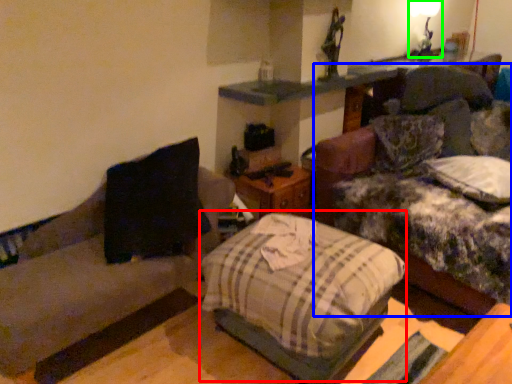
Question: Based on their relative distances, which object is nearer to bed (highlighted by a red box)? Choose from couch (highlighted by a blue box) and light fixture (highlighted by a green box).

Choices:
 (A) couch
 (B) light fixture

Answer: (A)